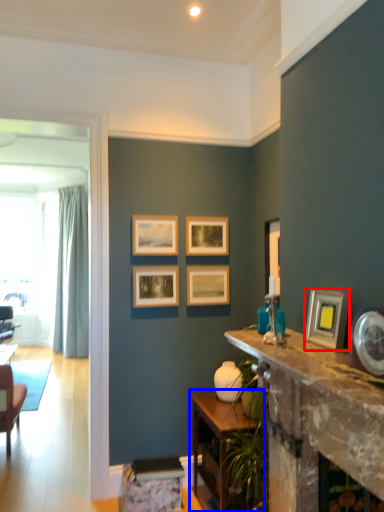
Question: Which object appears farthest to the camera in this image, picture frame (highlighted by a red box) or table (highlighted by a blue box)?

Choices:
 (A) picture frame
 (B) table

Answer: (B)